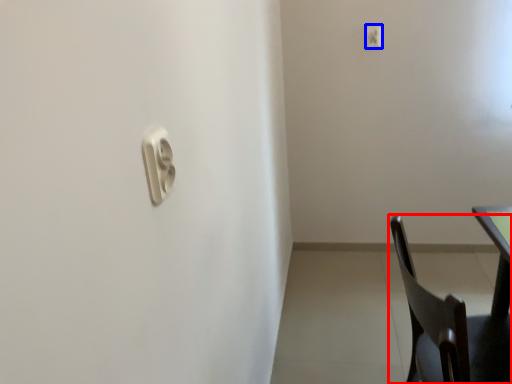
Question: Among these objects, which one is farthest to the camera, chair (highlighted by a red box) or light switch (highlighted by a blue box)?

Choices:
 (A) chair
 (B) light switch

Answer: (B)